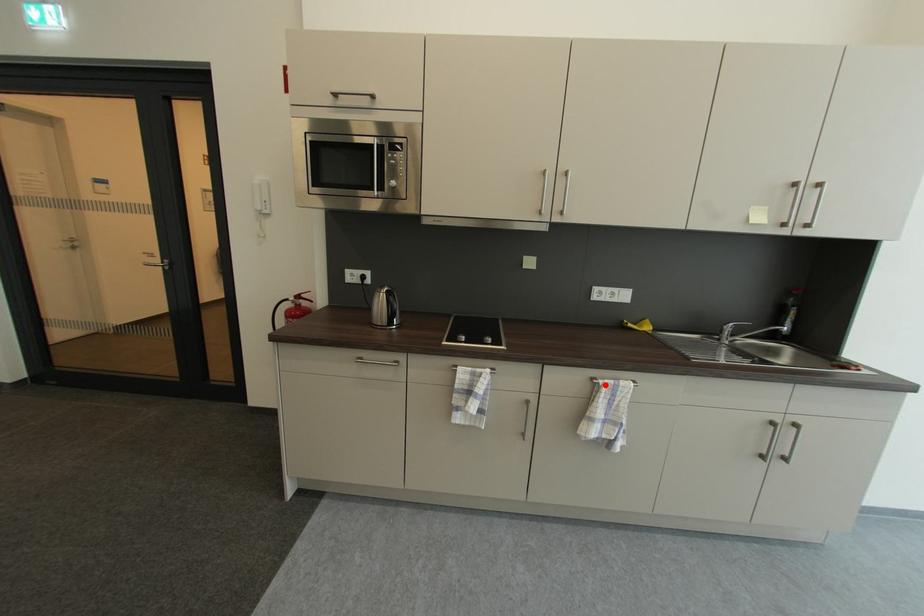
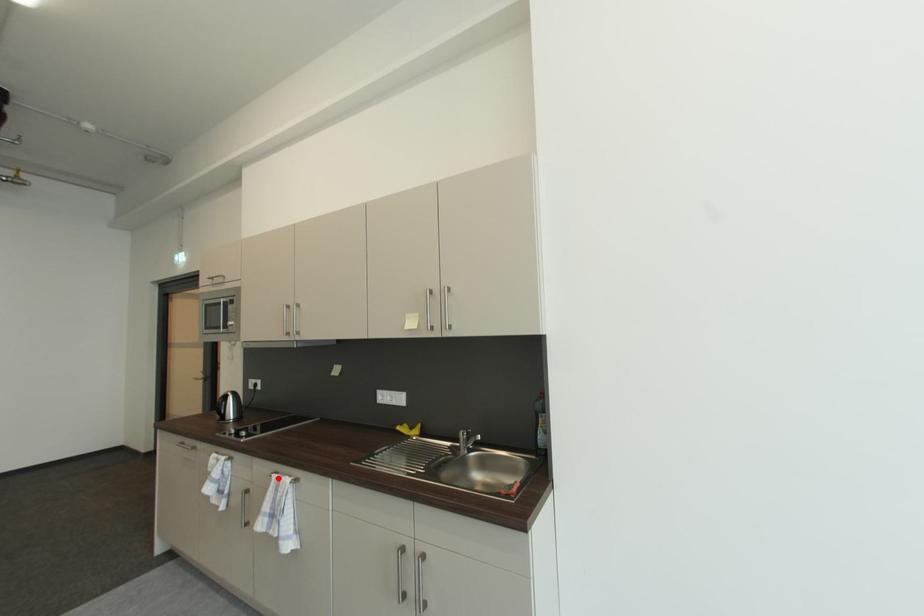
I am providing you with two images of the same scene from different viewpoints. A red point is marked on the first image and another point is marked on the second image. Are the points marked in image1 and image2 representing the same 3D position?

Yes